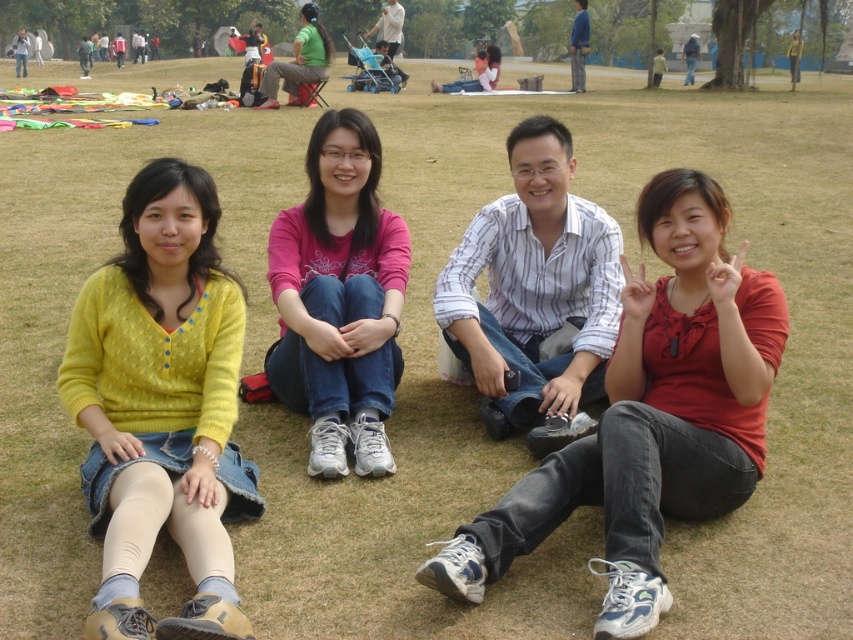
Is yellow knitted sweater at left thinner than pink fabric shirt at center?

Incorrect, yellow knitted sweater at left's width is not less than pink fabric shirt at center's.

What do you see at coordinates (161, 406) in the screenshot?
I see `yellow knitted sweater at left` at bounding box center [161, 406].

Is point (236, 292) positioned behind point (343, 400)?

That is False.

The width and height of the screenshot is (853, 640). I want to click on yellow knitted sweater at left, so click(161, 406).

Which is more to the right, matte red shirt at center or white striped shirt at center?

From the viewer's perspective, matte red shirt at center appears more on the right side.

Which is above, matte red shirt at center or white striped shirt at center?

white striped shirt at center

Is point (735, 433) positioned before point (474, 243)?

Yes, it is in front of point (474, 243).

Where is `matte red shirt at center`? This screenshot has height=640, width=853. matte red shirt at center is located at coordinates (650, 416).

Which is more to the left, pink fabric shirt at center or green matte shirt at upper center?

green matte shirt at upper center is more to the left.

Between pink fabric shirt at center and green matte shirt at upper center, which one is positioned higher?

green matte shirt at upper center

At what (x,y) coordinates should I click in order to perform the action: click on pink fabric shirt at center. Please return your answer as a coordinate pair (x, y). Image resolution: width=853 pixels, height=640 pixels. Looking at the image, I should click on (339, 298).

Image resolution: width=853 pixels, height=640 pixels. I want to click on pink fabric shirt at center, so click(339, 298).